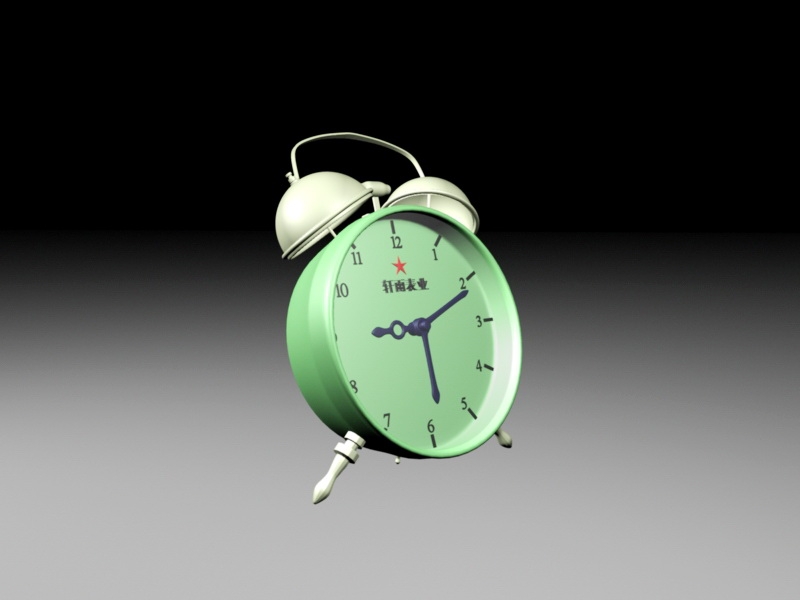
At what (x,y) coordinates should I click in order to perform the action: click on bells on top of alarm clock. Please return your answer as a coordinate pair (x, y). Looking at the image, I should click on (316, 196), (436, 184).